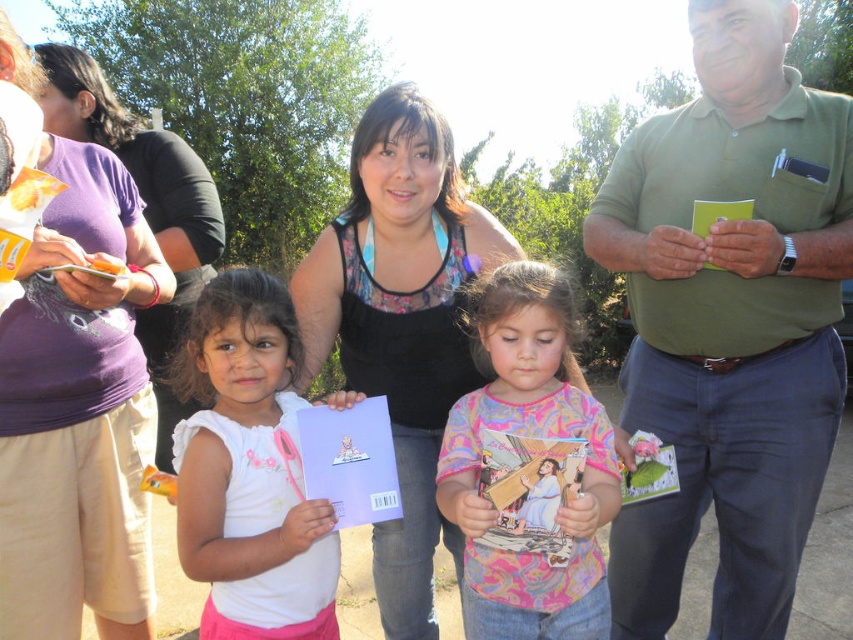
Question: Which point is farther from the camera taking this photo?

Choices:
 (A) (816, 173)
 (B) (138, 136)

Answer: (B)

Question: Considering the real-world distances, which object is farthest from the multicolored fabric shirt at center?

Choices:
 (A) white matte paper at center
 (B) green cotton shirt at center
 (C) purple fabric shirt at left
 (D) matte black tank top at center

Answer: (C)

Question: Which point is closer to the camera taking this photo?

Choices:
 (A) pos(599,589)
 (B) pos(256,326)
 (C) pos(672,232)
 (D) pos(196,182)

Answer: (B)

Question: Is green cotton shirt at center above multicolored fabric shirt at center?

Choices:
 (A) no
 (B) yes

Answer: (B)

Question: Can you confirm if matte black tank top at center is wider than multicolored fabric shirt at center?

Choices:
 (A) no
 (B) yes

Answer: (B)

Question: Does matte black tank top at center have a lesser width compared to purple fabric shirt at left?

Choices:
 (A) no
 (B) yes

Answer: (B)